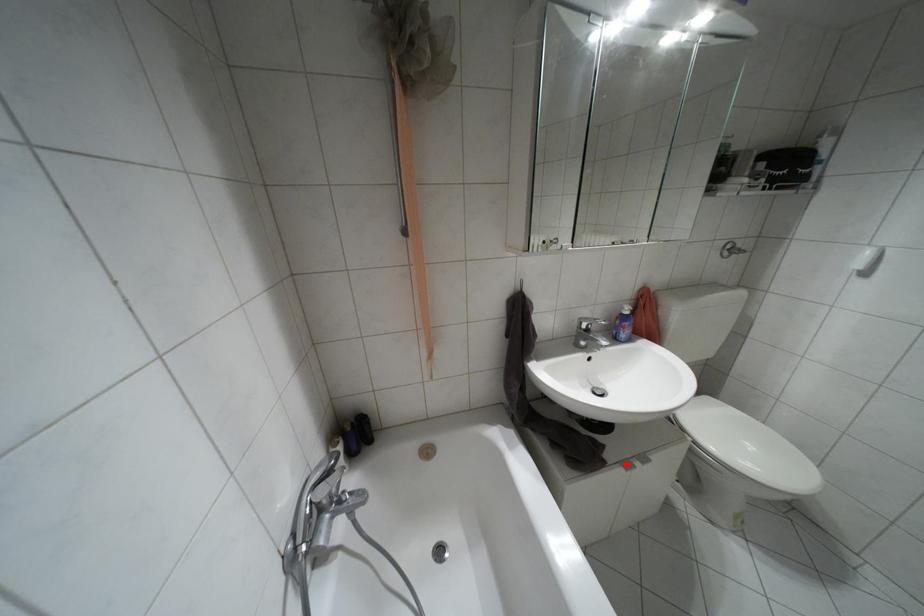
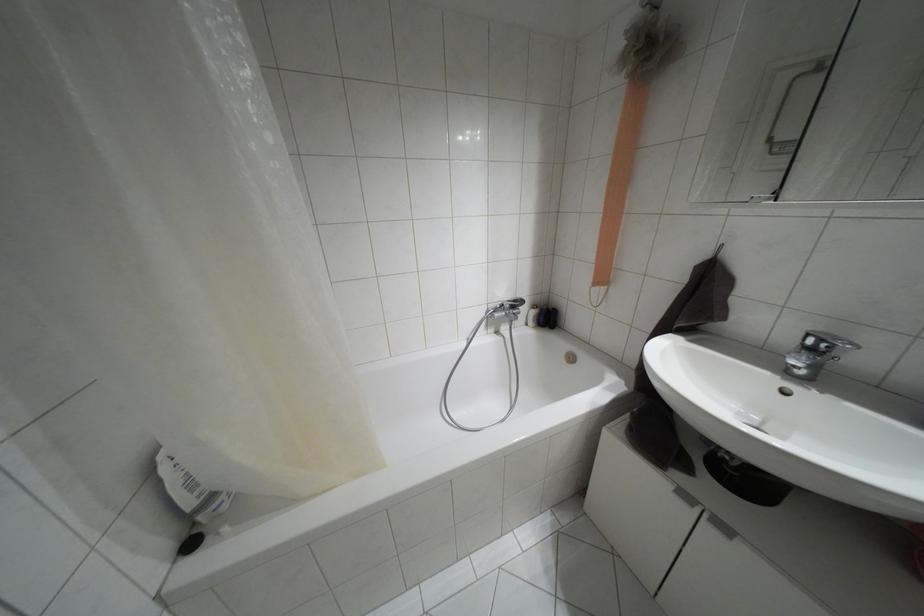
Question: I am providing you with two images of the same scene from different viewpoints. A red point is marked on the first image. Can you still see the location of the red point in image 2?

Choices:
 (A) Yes
 (B) No

Answer: (A)